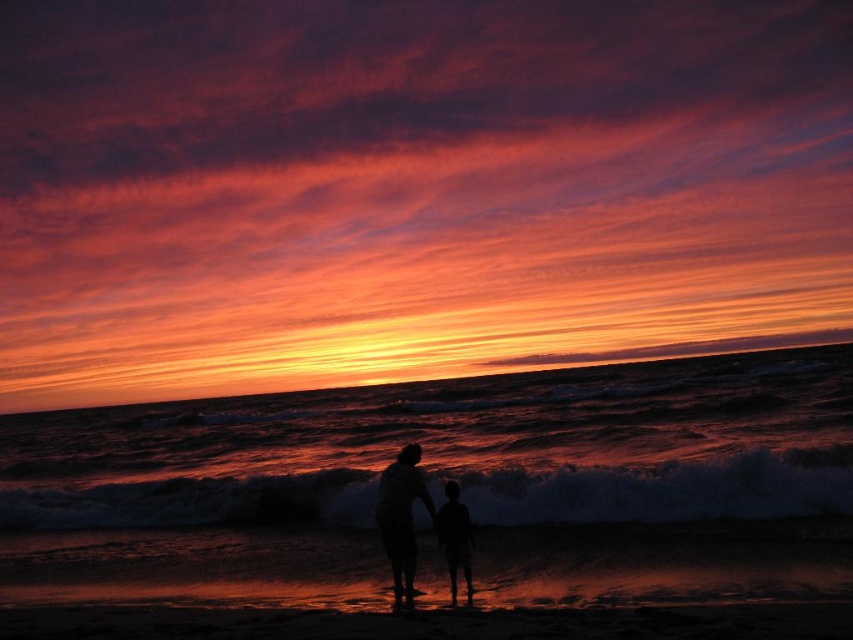
Question: Based on their relative distances, which object is farther from the dark textured wave at center?

Choices:
 (A) silhouette figure at lower center
 (B) silhouette figure at center

Answer: (B)

Question: Where is dark textured wave at center located in relation to silhouette figure at lower center in the image?

Choices:
 (A) below
 (B) above

Answer: (A)

Question: Among these points, which one is farthest from the camera?

Choices:
 (A) (451, 496)
 (B) (218, 497)
 (C) (415, 481)

Answer: (B)

Question: Does dark textured wave at center have a lesser width compared to silhouette figure at lower center?

Choices:
 (A) yes
 (B) no

Answer: (B)

Question: Considering the real-world distances, which object is closest to the silhouette figure at center?

Choices:
 (A) silhouette figure at lower center
 (B) dark textured wave at center

Answer: (A)

Question: Is dark textured wave at center to the right of silhouette figure at center from the viewer's perspective?

Choices:
 (A) yes
 (B) no

Answer: (B)